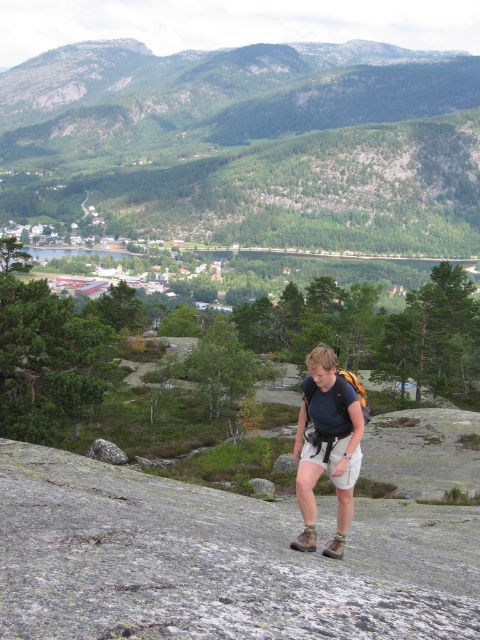
Who is more forward, (0, 74) or (119, 452)?

Point (119, 452) is more forward.

Is point (93, 84) positioned in front of point (96, 442)?

No.

You are a GUI agent. You are given a task and a screenshot of the screen. Output one action in this format:
    pyautogui.click(x=<x>, y=<y>)
    Task: Click on the green forested mountain at upper center
    Image resolution: width=480 pixels, height=640 pixels.
    Given the screenshot: What is the action you would take?
    click(250, 144)

Can you confirm if khaki cotton shorts at center is positioned below smooth gray rock at center?

Incorrect, khaki cotton shorts at center is not positioned below smooth gray rock at center.

Is khaki cotton shorts at center closer to the viewer compared to smooth gray rock at center?

Yes, it is in front of smooth gray rock at center.

Identify the location of khaki cotton shorts at center. This screenshot has width=480, height=640. (324, 452).

Is green forested mountain at upper center smaller than matte black backpack at center?

Actually, green forested mountain at upper center might be larger than matte black backpack at center.

Is point (147, 77) farther from viewer compared to point (320, 403)?

Yes, it is behind point (320, 403).

Where is `green forested mountain at upper center`? The image size is (480, 640). green forested mountain at upper center is located at coordinates (250, 144).